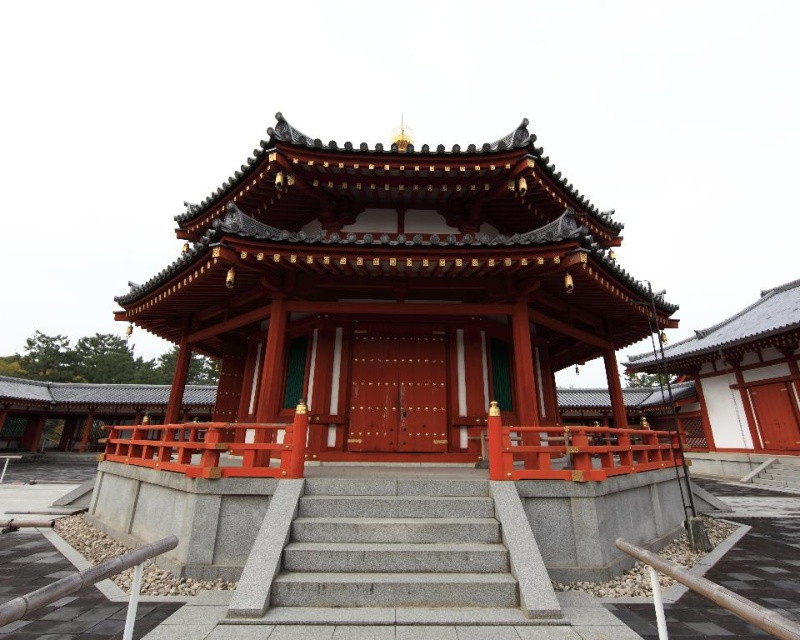
Who is more forward, (345, 545) or (656, 444)?

Point (345, 545) is in front.

Does gray granite stairs at center appear on the right side of smooth glossy wood rail at center?

In fact, gray granite stairs at center is to the left of smooth glossy wood rail at center.

Where is `gray granite stairs at center`? gray granite stairs at center is located at coordinates (394, 545).

Who is higher up, matte red wood temple at center or brown wooden rail at lower left?

matte red wood temple at center

Who is more forward, (296, 324) or (134, 614)?

Point (134, 614) is more forward.

This screenshot has width=800, height=640. In order to click on matte red wood temple at center in this screenshot , I will do `click(394, 292)`.

Is matte red wood temple at center in front of smooth glossy wood rail at center?

Yes, matte red wood temple at center is closer to the viewer.

Does matte red wood temple at center appear on the left side of smooth glossy wood rail at center?

Correct, you'll find matte red wood temple at center to the left of smooth glossy wood rail at center.

The height and width of the screenshot is (640, 800). In order to click on matte red wood temple at center in this screenshot , I will do pos(394,292).

Locate an element on the screen. matte red wood temple at center is located at coordinates (394, 292).